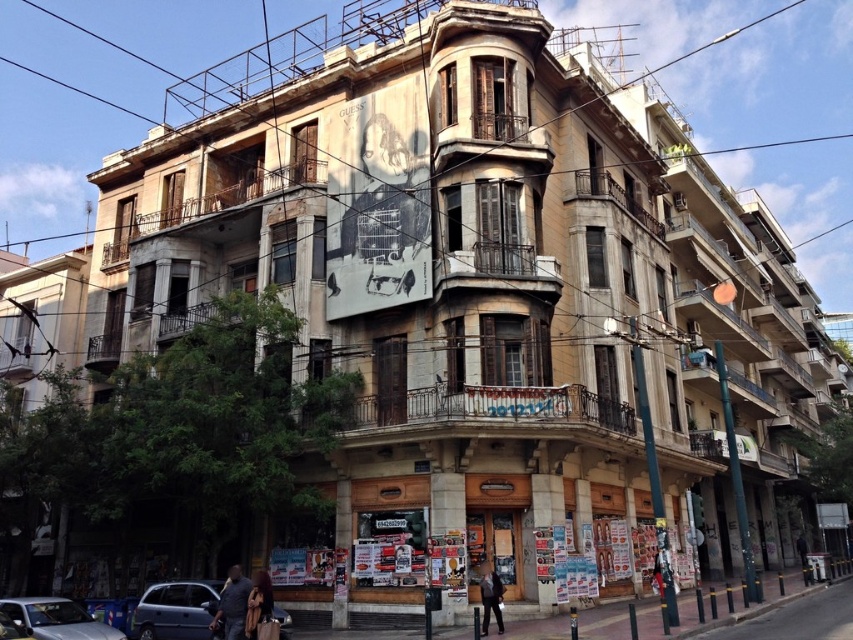
Question: Is matte blue van at lower left positioned in front of blue metallic car at lower left?

Choices:
 (A) yes
 (B) no

Answer: (B)

Question: Which point appears closest to the camera in this image?

Choices:
 (A) (114, 636)
 (B) (154, 602)

Answer: (A)

Question: Does matte blue van at lower left have a greater width compared to blue metallic car at lower left?

Choices:
 (A) yes
 (B) no

Answer: (B)

Question: Can you confirm if matte blue van at lower left is bigger than blue metallic car at lower left?

Choices:
 (A) no
 (B) yes

Answer: (A)